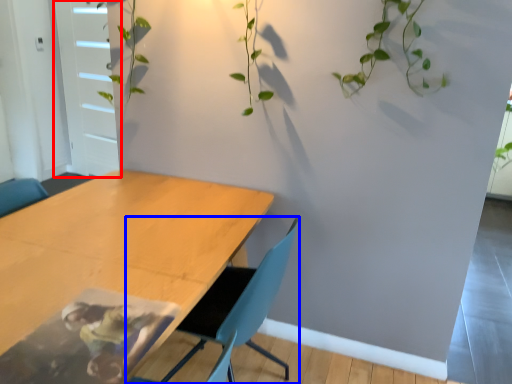
Question: Which object is further to the camera taking this photo, glass door (highlighted by a red box) or chair (highlighted by a blue box)?

Choices:
 (A) glass door
 (B) chair

Answer: (A)